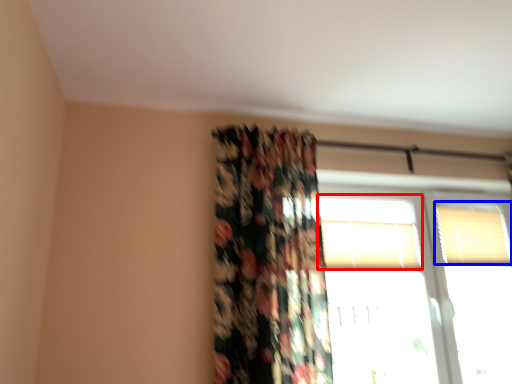
Question: Which point is further to the camera, window (highlighted by a red box) or window (highlighted by a blue box)?

Choices:
 (A) window
 (B) window

Answer: (B)